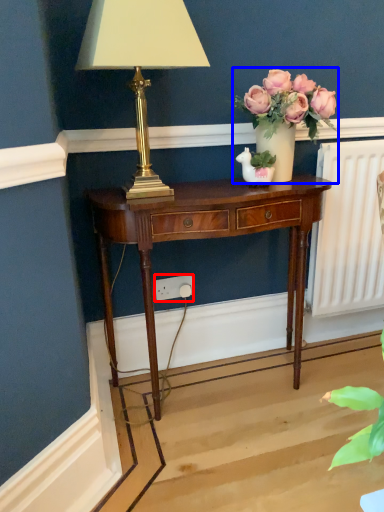
Question: Which of the following is the farthest to the observer, power outlet (highlighted by a red box) or houseplant (highlighted by a blue box)?

Choices:
 (A) power outlet
 (B) houseplant

Answer: (A)